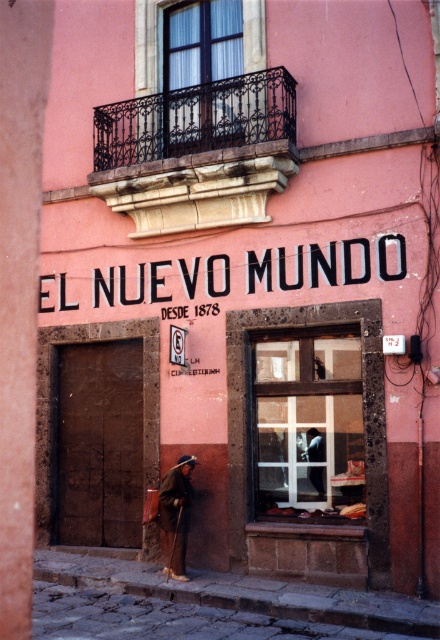
You are standing in front of the pink building and want to touch both points on the facade. Which point should you reach for first, the point at coordinates point (167,538) or the point at coordinates point (315,440)?

You should reach for point (167,538) first because it is closer to you than point (315,440), which is further away.

You are a guest at a hotel and see both the brown woolen robe at lower center and the white cotton robe at center. You want to grab one quickly. Which robe is closer to you?

The brown woolen robe at lower center is closer to you since it is 5.44 feet away from the white cotton robe at center, but the distance between them doesn answer the question of proximity to the observer. Please provide more information about their positions relative to the observer.

You are standing in front of the pink building and want to locate the brown woolen robe at lower center. According to the coordinates provided, where exactly should you look?

The brown woolen robe at lower center is located at coordinates point (176, 513).